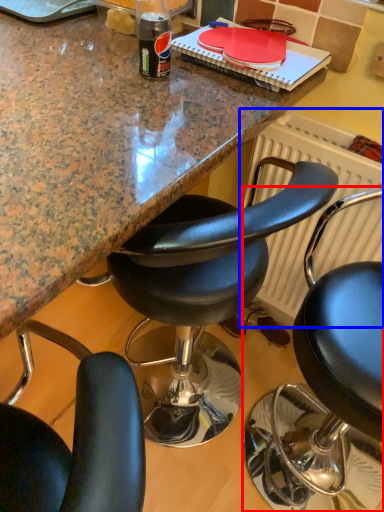
Question: Which point is closer to the camera, chair (highlighted by a red box) or radiator (highlighted by a blue box)?

Choices:
 (A) chair
 (B) radiator

Answer: (A)